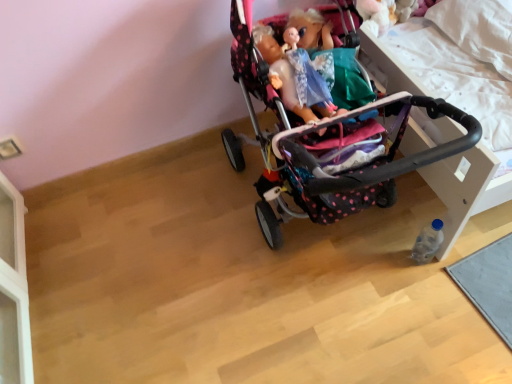
Question: From a real-world perspective, is clear plastic bottle at lower right above or below polka dot fabric stroller at center?

Choices:
 (A) above
 (B) below

Answer: (B)

Question: Is clear plastic bottle at lower right inside or outside of polka dot fabric stroller at center?

Choices:
 (A) outside
 (B) inside

Answer: (B)

Question: Considering the positions of clear plastic bottle at lower right and polka dot fabric stroller at center in the image, is clear plastic bottle at lower right bigger or smaller than polka dot fabric stroller at center?

Choices:
 (A) big
 (B) small

Answer: (B)

Question: From a real-world perspective, is polka dot fabric stroller at center physically located above or below clear plastic bottle at lower right?

Choices:
 (A) below
 (B) above

Answer: (B)

Question: Is polka dot fabric stroller at center situated inside clear plastic bottle at lower right or outside?

Choices:
 (A) outside
 (B) inside

Answer: (A)

Question: From the image's perspective, is polka dot fabric stroller at center positioned above or below clear plastic bottle at lower right?

Choices:
 (A) above
 (B) below

Answer: (A)

Question: In the image, is polka dot fabric stroller at center on the left side or the right side of clear plastic bottle at lower right?

Choices:
 (A) right
 (B) left

Answer: (B)